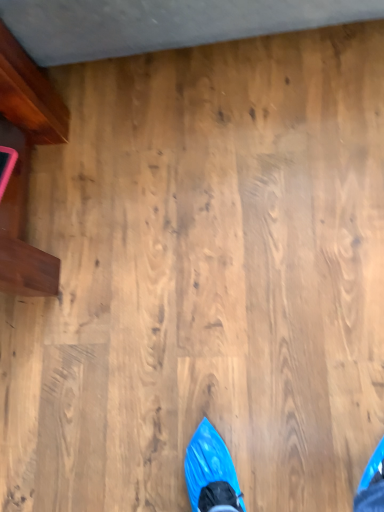
Where is `free location in front of wooden desk at left`? free location in front of wooden desk at left is located at coordinates (102, 305).